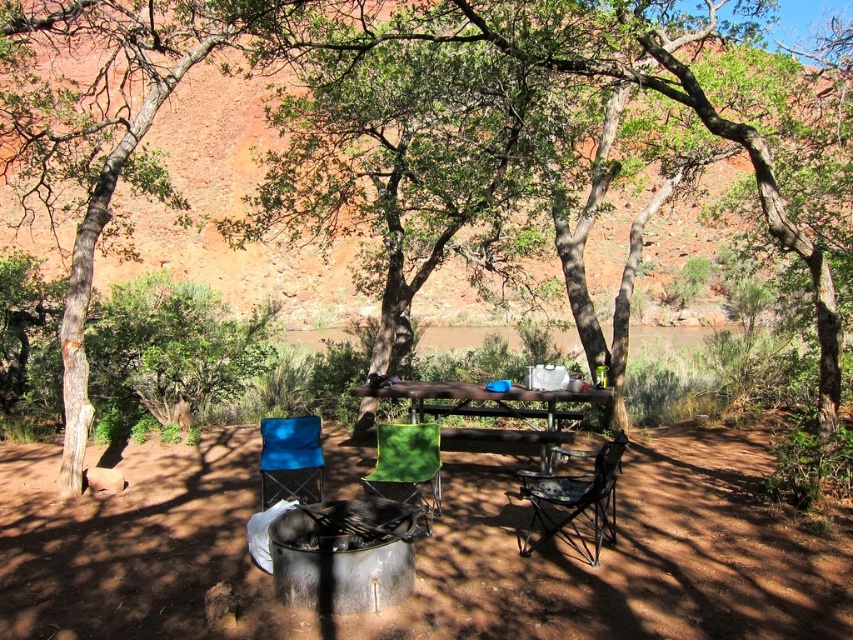
Based on the photo, you are a hiker trying to navigate between two points in the camping area. The first point is point (546, 468) and the second is point (379, 496). Which point is closer to you?

Point (546, 468) is closer to you because it is further to the viewer than point (379, 496).

You are standing at the point labeled as point (x=426, y=552) in the image. What is the color and texture of the ground beneath your feet?

The ground at point (x=426, y=552) is brown dirt field at center, which is reddish brown in color and has a dirt texture.

You are setting up a campsite and want to place a tent between the wooden picnic table at center and the green fabric chair at center. According to the scene, which object should the tent be closer to?

The wooden picnic table at center is positioned on the right side of green fabric chair at center, so the tent should be placed closer to the green fabric chair at center to be between them.